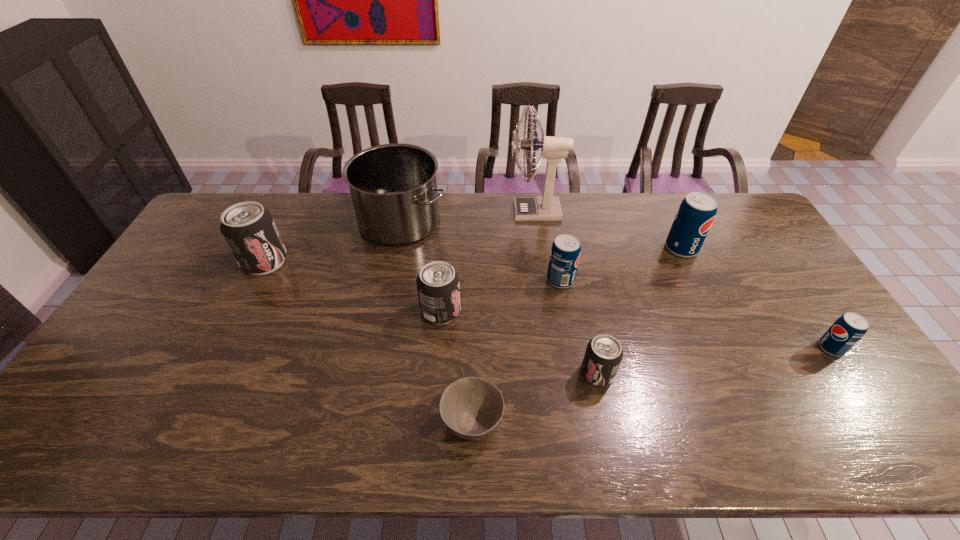
Find the location of a particular element. the tallest object is located at coordinates (546, 208).

Locate an element on the screen. blue fan is located at coordinates (546, 208).

You are a GUI agent. You are given a task and a screenshot of the screen. Output one action in this format:
    pyautogui.click(x=<x>, y=<y>)
    Task: Click on the saucepan
    The width and height of the screenshot is (960, 540).
    Given the screenshot: What is the action you would take?
    point(393,187)

At what (x,y) coordinates should I click in order to perform the action: click on the biggest blue pop. Please return your answer as a coordinate pair (x, y). The image size is (960, 540). Looking at the image, I should click on (696, 213).

You are a GUI agent. You are given a task and a screenshot of the screen. Output one action in this format:
    pyautogui.click(x=<x>, y=<y>)
    Task: Click on the second object from right to left
    
    Given the screenshot: What is the action you would take?
    pyautogui.click(x=696, y=213)

I want to click on the farthest black soda can, so click(249, 229).

Find the location of a particular element. The image size is (960, 540). the biggest black soda can is located at coordinates (249, 229).

The image size is (960, 540). In order to click on the leftmost blue pop in this screenshot , I will do `click(565, 253)`.

You are a GUI agent. You are given a task and a screenshot of the screen. Output one action in this format:
    pyautogui.click(x=<x>, y=<y>)
    Task: Click on the second biggest blue pop
    The image size is (960, 540).
    Given the screenshot: What is the action you would take?
    pyautogui.click(x=565, y=253)

You are a GUI agent. You are given a task and a screenshot of the screen. Output one action in this format:
    pyautogui.click(x=<x>, y=<y>)
    Task: Click on the third nearest soda can
    The image size is (960, 540).
    Given the screenshot: What is the action you would take?
    pyautogui.click(x=438, y=286)